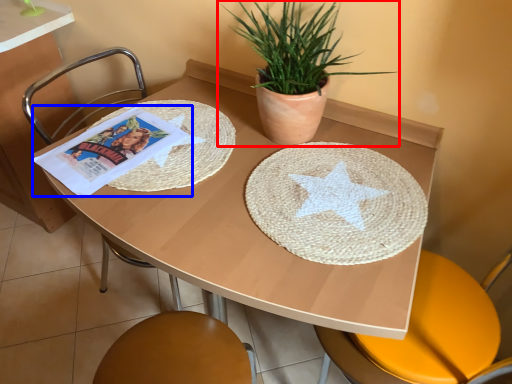
Question: Which of the following is the farthest to the observer, houseplant (highlighted by a red box) or comic book (highlighted by a blue box)?

Choices:
 (A) houseplant
 (B) comic book

Answer: (B)